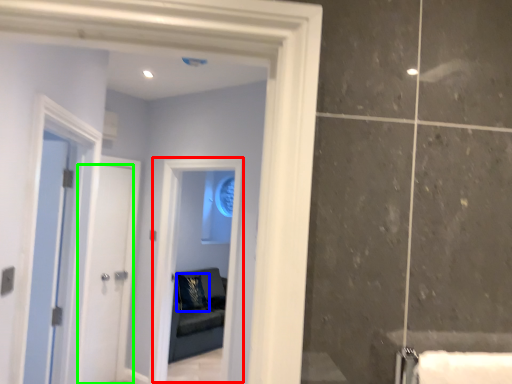
Question: Estimate the real-world distances between objects in this image. Which object is closer to window (highlighted by a red box), pillow (highlighted by a blue box) or door (highlighted by a green box)?

Choices:
 (A) pillow
 (B) door

Answer: (B)